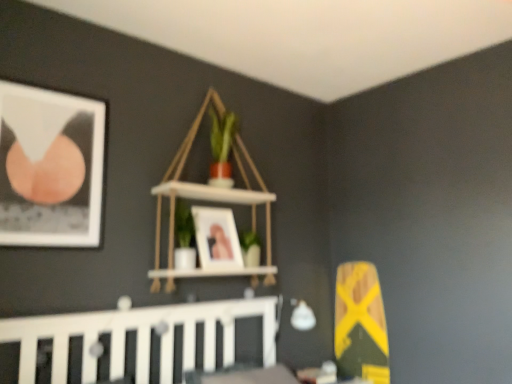
Question: Could you tell me if white wooden crib at lower left is facing matte wooden picture frame at center, which is the second picture frame in front-to-back order?

Choices:
 (A) no
 (B) yes

Answer: (A)

Question: Is white wooden crib at lower left smaller than matte wooden picture frame at center, which appears as the second picture frame when viewed from the left?

Choices:
 (A) no
 (B) yes

Answer: (A)

Question: Is white wooden crib at lower left at the left side of matte wooden picture frame at center, which appears as the second picture frame when viewed from the left?

Choices:
 (A) no
 (B) yes

Answer: (A)

Question: Is white wooden crib at lower left further to the viewer compared to matte wooden picture frame at center, acting as the 1th picture frame starting from the right?

Choices:
 (A) no
 (B) yes

Answer: (A)

Question: Considering the relative sizes of white wooden crib at lower left and matte wooden picture frame at center, the 1th picture frame in the back-to-front sequence, in the image provided, is white wooden crib at lower left shorter than matte wooden picture frame at center, the 1th picture frame in the back-to-front sequence,?

Choices:
 (A) no
 (B) yes

Answer: (A)

Question: Can you confirm if white wooden crib at lower left is wider than matte wooden picture frame at center, which appears as the second picture frame when viewed from the left?

Choices:
 (A) no
 (B) yes

Answer: (B)

Question: Is matte wooden picture frame at center, which appears as the second picture frame when viewed from the left, positioned beyond the bounds of matte black picture frame at upper left, arranged as the 1th picture frame when viewed from the front?

Choices:
 (A) yes
 (B) no

Answer: (A)

Question: Are matte wooden picture frame at center, acting as the 1th picture frame starting from the right, and matte black picture frame at upper left, the second picture frame viewed from the back, located far from each other?

Choices:
 (A) yes
 (B) no

Answer: (B)

Question: From a real-world perspective, is matte wooden picture frame at center, the 1th picture frame in the back-to-front sequence, physically above matte black picture frame at upper left, arranged as the 1th picture frame when viewed from the front?

Choices:
 (A) yes
 (B) no

Answer: (B)

Question: Is matte wooden picture frame at center, the 1th picture frame in the back-to-front sequence, behind matte black picture frame at upper left, marked as the 1th picture frame in a left-to-right arrangement?

Choices:
 (A) yes
 (B) no

Answer: (A)

Question: From a real-world perspective, is matte wooden picture frame at center, the 1th picture frame in the back-to-front sequence, positioned under matte black picture frame at upper left, the second picture frame viewed from the back, based on gravity?

Choices:
 (A) no
 (B) yes

Answer: (B)

Question: From the image's perspective, does matte wooden picture frame at center, which appears as the second picture frame when viewed from the left, appear lower than matte black picture frame at upper left, the second picture frame viewed from the back?

Choices:
 (A) yes
 (B) no

Answer: (A)

Question: Considering the relative sizes of white wooden crib at lower left and white wood shelf at upper center in the image provided, is white wooden crib at lower left taller than white wood shelf at upper center?

Choices:
 (A) no
 (B) yes

Answer: (A)